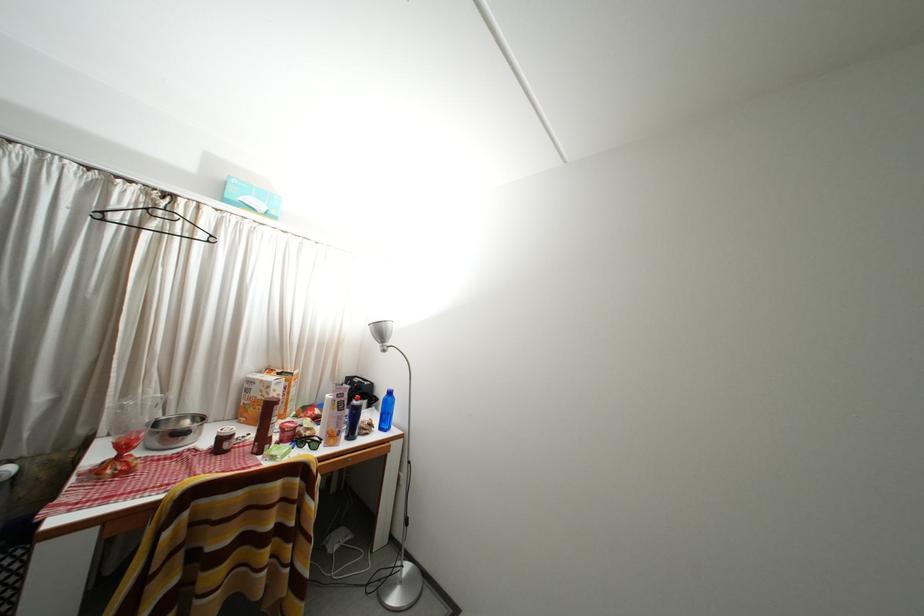
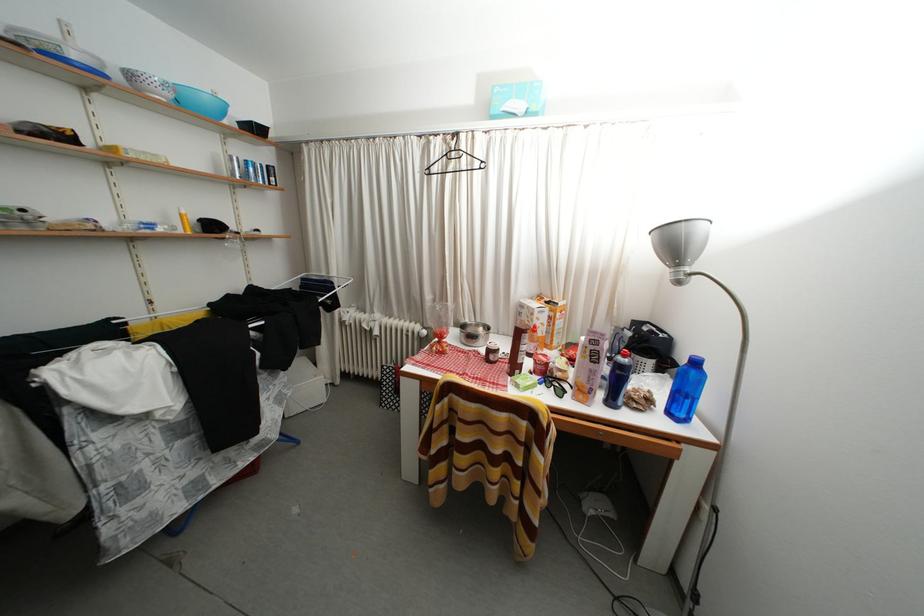
Locate, in the second image, the point that corresponds to (x=259, y=387) in the first image.

(529, 310)